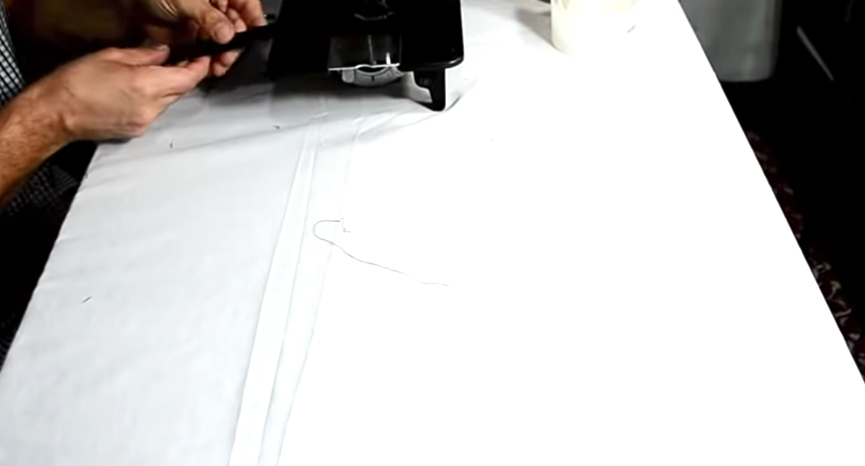
I want to click on floor, so click(x=830, y=232).